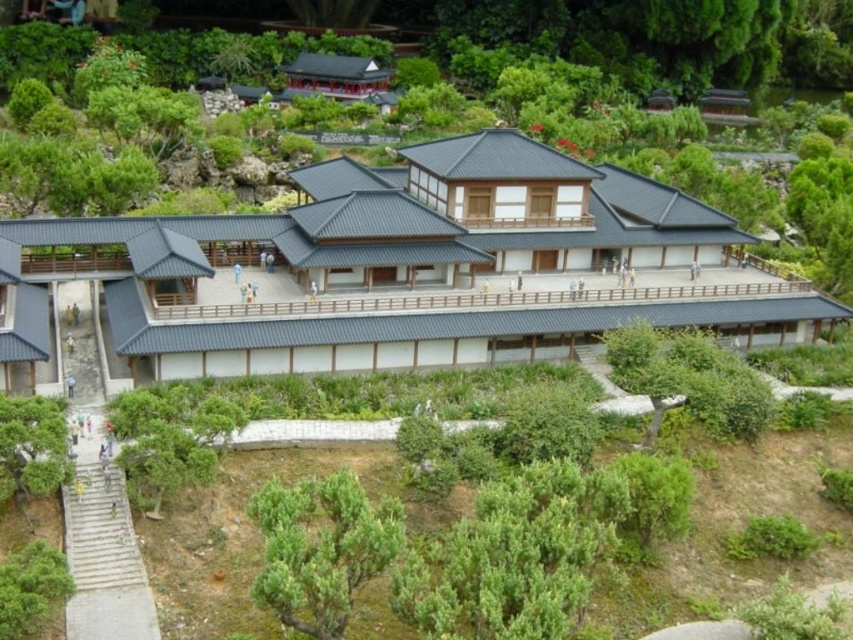
You are a landscape architect planning to install a new pathway between the green leafy shrub at lower center and the green leafy tree at lower left. If the pathway requires a minimum of 10 meters between the two plants to be feasible, is this possible?

The distance between the green leafy shrub at lower center and the green leafy tree at lower left is 12.78 meters, which exceeds the required 10 meters. Therefore, installing the pathway is feasible.

You are a landscape architect designing a new garden. You have two plants to place in the garden layout. The green leafy shrub at lower center and the green leafy tree at lower left. Which one should you choose if you need a larger plant for a focal point?

The green leafy shrub at lower center is bigger than the green leafy tree at lower left, so you should choose the green leafy shrub at lower center for the focal point.